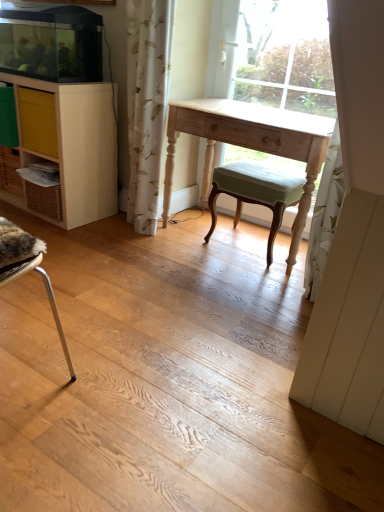
Locate an element on the screen. vacant space in between light wood cabinet at left and white floral fabric curtain at center is located at coordinates (114, 227).